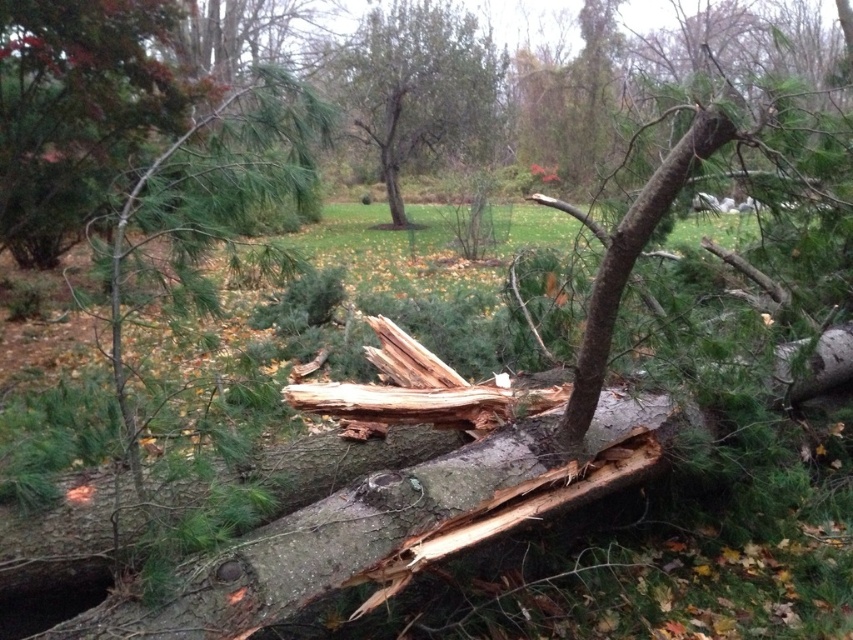
Looking at this image, you are a park maintenance worker assessing the fallen tree. You notice the smooth bark log at center and the green matte pine branch at upper left. Which object is shorter in height?

The smooth bark log at center is shorter in height compared to the green matte pine branch at upper left.

You are a park maintenance worker assessing the fallen tree. You need to determine if the green matte pine branch at upper left can be safely removed before the green rough bark tree at center. Based on their sizes, which one requires more effort to remove?

The green rough bark tree at center requires more effort to remove because it is larger than the green matte pine branch at upper left.

You are a park maintenance worker assessing the fallen tree. You notice the smooth bark log at center and the green matte pine branch at upper left. Which object is positioned lower in the scene?

The smooth bark log at center is below the green matte pine branch at upper left, so it is positioned lower in the scene.